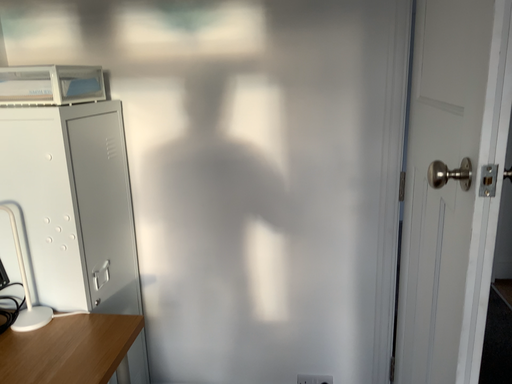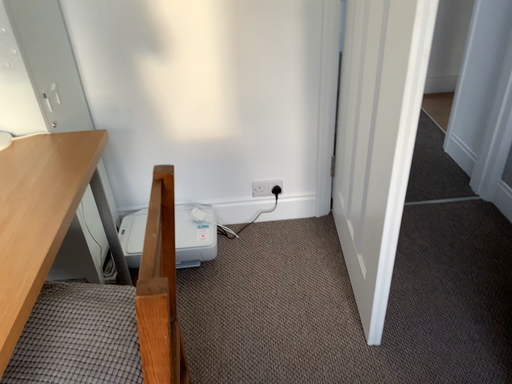
Question: Which way did the camera rotate in the video?

Choices:
 (A) rotated right
 (B) rotated left

Answer: (A)